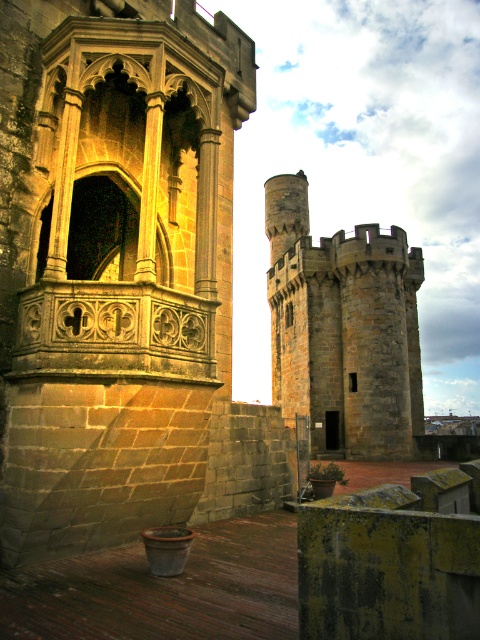
You are standing in front of the medieval stone structure and see two points marked on the image. Which point, point (68,307) or point (287,376), is closer to you?

Point (68,307) is closer to you than point (287,376).

Based on the scene described, which object is larger in size between the stone carved balcony at center and the stone tower at center?

The stone tower at center is larger than the stone carved balcony at center.

You are an architect examining a medieval stone structure. You notice a point marked at coordinates [119,273]. Based on the scene description, what architectural feature is located at this point?

The point at coordinates [119,273] marks the location of the stone carved balcony at center.